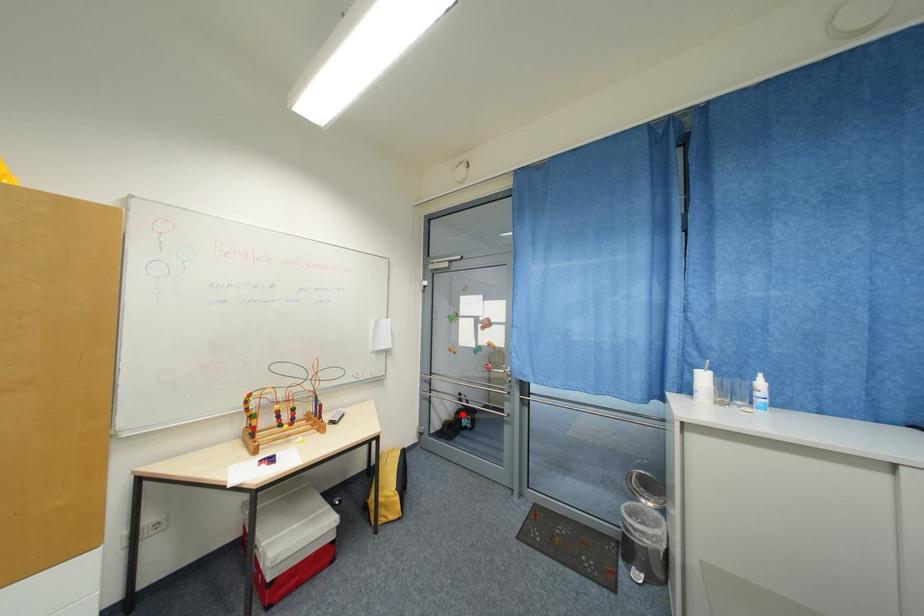
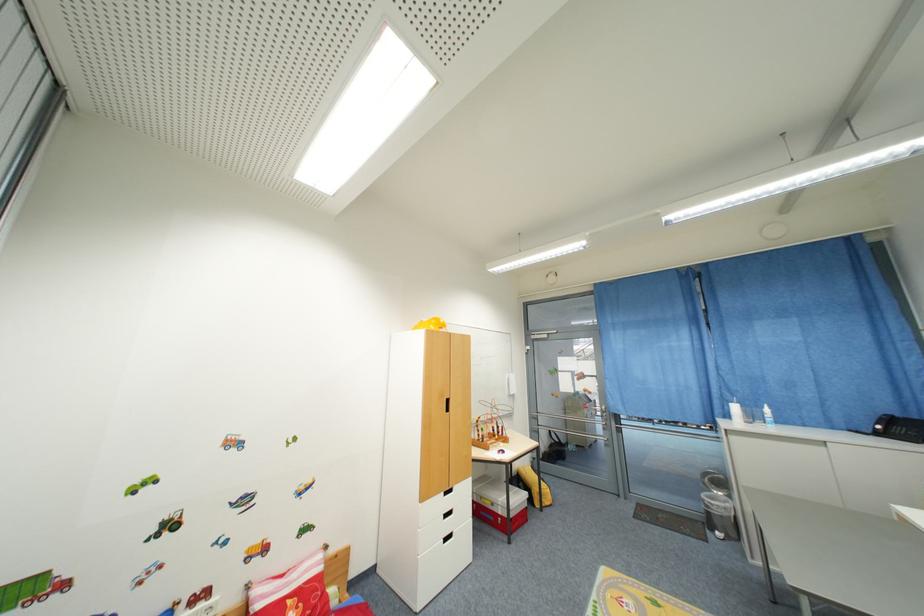
Where in the second image is the point corresponding to the highlighted location from the first image?

(555, 448)